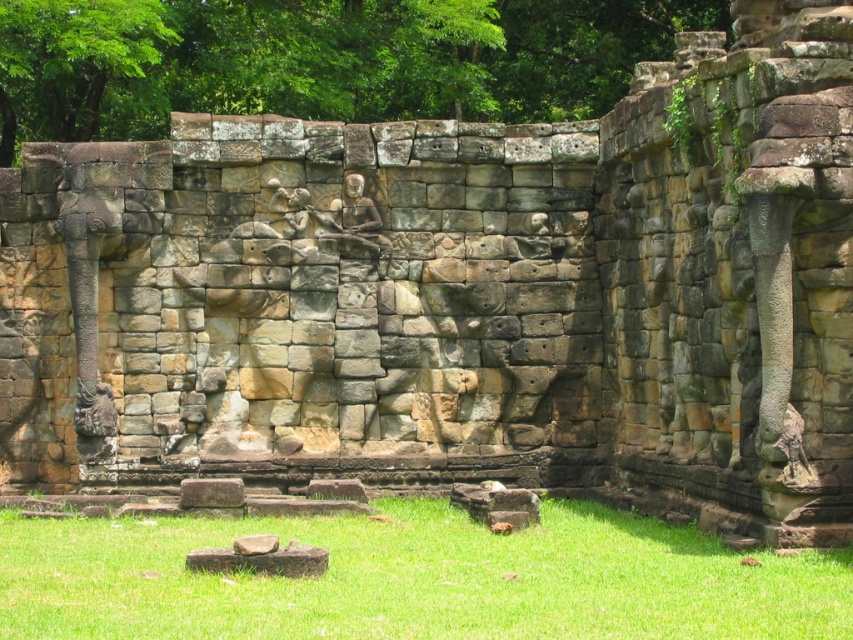
You are standing at the base of the ancient stone wall and want to place a small decorative stone exactly at the location of the green grass at lower center. What are the coordinates where you should place it?

The coordinates for the green grass at lower center are at point (415, 579). Place the decorative stone there.

You are an archaeologist examining the ancient stone wall. You notice the brown stone elephant at left and the rustic stone carving at center. Which object is wider?

The brown stone elephant at left is wider than the rustic stone carving at center because its width surpasses the latter.

From the picture: You are standing in front of the ancient stone wall and notice the green grass at lower center and the rustic stone carving at center. Which object is nearer to you?

The green grass at lower center is closer to the viewer than the rustic stone carving at center.